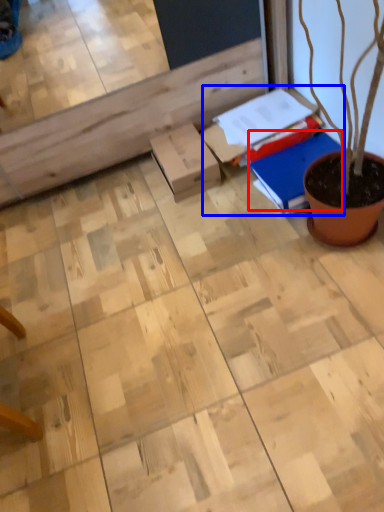
Question: Which point is further to the camera, notebook (highlighted by a red box) or book (highlighted by a blue box)?

Choices:
 (A) notebook
 (B) book

Answer: (B)